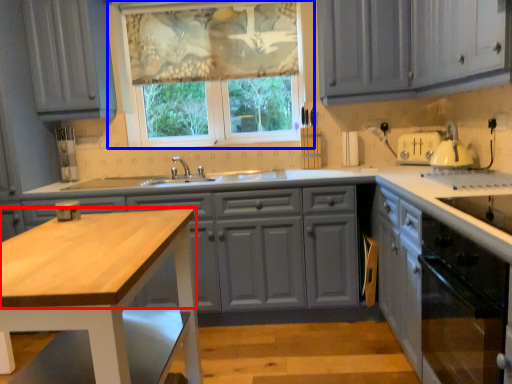
Question: Which object appears closest to the camera in this image, countertop (highlighted by a red box) or window (highlighted by a blue box)?

Choices:
 (A) countertop
 (B) window

Answer: (A)